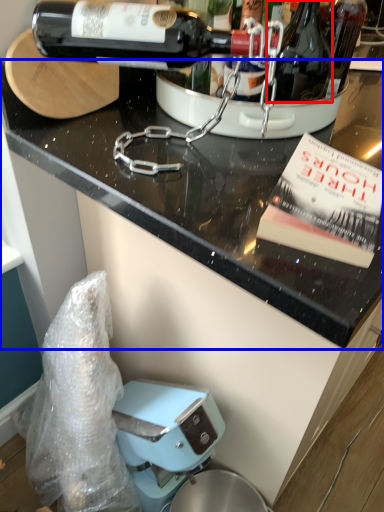
Question: Which point is closer to the camera, bottle (highlighted by a red box) or countertop (highlighted by a blue box)?

Choices:
 (A) bottle
 (B) countertop

Answer: (B)